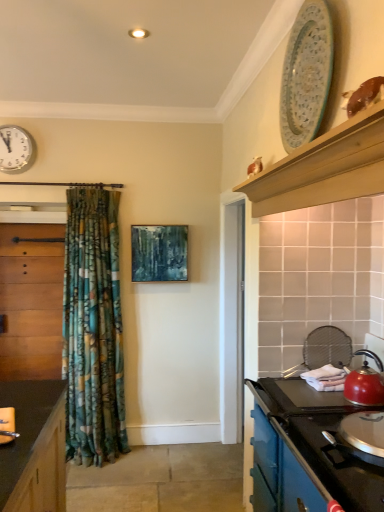
Question: Is teal matte painting at center smaller than matte red kettle at right?

Choices:
 (A) no
 (B) yes

Answer: (A)

Question: Would you say teal matte painting at center is a long distance from matte red kettle at right?

Choices:
 (A) no
 (B) yes

Answer: (B)

Question: Is teal matte painting at center oriented towards matte red kettle at right?

Choices:
 (A) yes
 (B) no

Answer: (B)

Question: Does teal matte painting at center appear on the right side of matte red kettle at right?

Choices:
 (A) yes
 (B) no

Answer: (B)

Question: From a real-world perspective, is teal matte painting at center located beneath matte red kettle at right?

Choices:
 (A) yes
 (B) no

Answer: (B)

Question: From a real-world perspective, is teal matte painting at center on matte red kettle at right?

Choices:
 (A) yes
 (B) no

Answer: (A)

Question: From a real-world perspective, is blue enamel stove at lower right, the 2th cabinetry when ordered from left to right, over teal matte painting at center?

Choices:
 (A) no
 (B) yes

Answer: (A)

Question: Would you say blue enamel stove at lower right, placed as the second cabinetry when sorted from back to front, contains teal matte painting at center?

Choices:
 (A) yes
 (B) no

Answer: (B)

Question: Does blue enamel stove at lower right, the first cabinetry from the right, have a greater height compared to teal matte painting at center?

Choices:
 (A) no
 (B) yes

Answer: (B)

Question: Can you confirm if blue enamel stove at lower right, placed as the second cabinetry when sorted from back to front, is wider than teal matte painting at center?

Choices:
 (A) no
 (B) yes

Answer: (B)

Question: Does blue enamel stove at lower right, the first cabinetry positioned from the front, turn towards teal matte painting at center?

Choices:
 (A) no
 (B) yes

Answer: (A)

Question: Are blue enamel stove at lower right, the 2th cabinetry when ordered from left to right, and teal matte painting at center making contact?

Choices:
 (A) no
 (B) yes

Answer: (A)

Question: Could blue enamel stove at lower right, the 2th cabinetry when ordered from left to right, be considered to be inside porcelain plate at upper right?

Choices:
 (A) yes
 (B) no

Answer: (B)